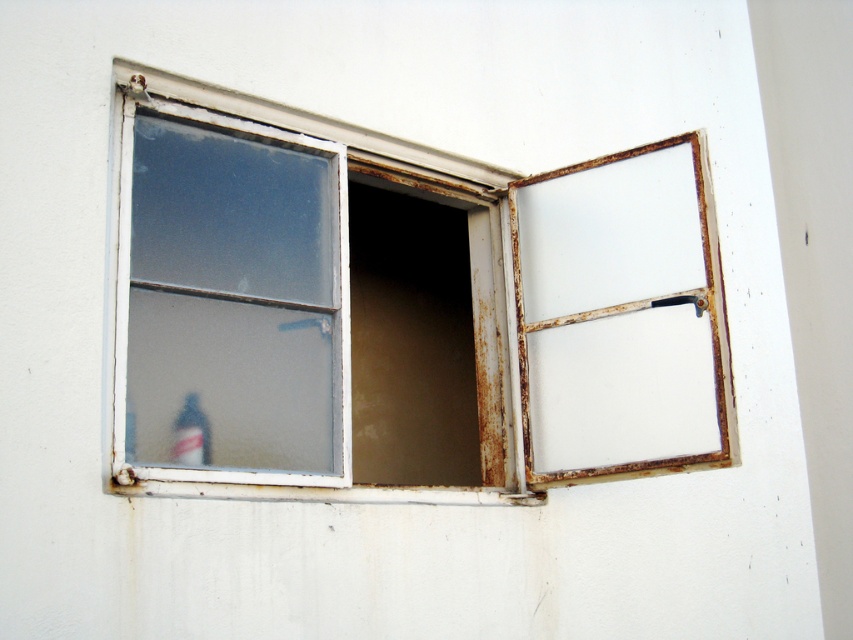
Question: In this image, where is rusty metal window at center located relative to translucent glass bottle at lower left?

Choices:
 (A) left
 (B) right

Answer: (B)

Question: Is rusty metal window at center positioned at the back of translucent glass bottle at lower left?

Choices:
 (A) yes
 (B) no

Answer: (B)

Question: Can you confirm if rusty metal window at center is positioned to the left of translucent glass bottle at lower left?

Choices:
 (A) yes
 (B) no

Answer: (B)

Question: Which point appears closest to the camera in this image?

Choices:
 (A) (186, 426)
 (B) (357, 483)

Answer: (A)